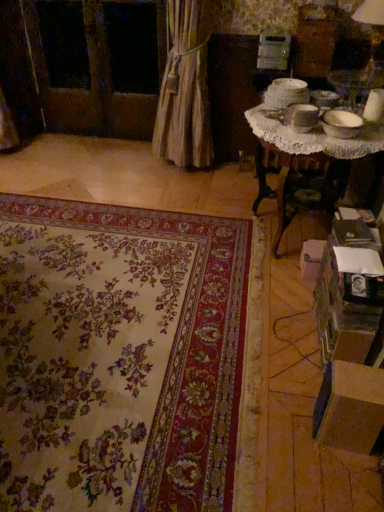
Question: Can you confirm if beige fabric curtain at left is bigger than matte white table lamp at upper right?

Choices:
 (A) yes
 (B) no

Answer: (A)

Question: From a real-world perspective, is beige fabric curtain at left positioned over matte white table lamp at upper right based on gravity?

Choices:
 (A) no
 (B) yes

Answer: (A)

Question: Is beige fabric curtain at left looking in the opposite direction of matte white table lamp at upper right?

Choices:
 (A) yes
 (B) no

Answer: (B)

Question: From a real-world perspective, is beige fabric curtain at left beneath matte white table lamp at upper right?

Choices:
 (A) yes
 (B) no

Answer: (A)

Question: Considering the relative positions of beige fabric curtain at left and matte white table lamp at upper right in the image provided, is beige fabric curtain at left behind matte white table lamp at upper right?

Choices:
 (A) no
 (B) yes

Answer: (B)

Question: In the image, is floral carpet at center positioned in front of or behind white lace table at upper right?

Choices:
 (A) front
 (B) behind

Answer: (A)

Question: From their relative heights in the image, would you say floral carpet at center is taller or shorter than white lace table at upper right?

Choices:
 (A) short
 (B) tall

Answer: (A)

Question: Would you say floral carpet at center is inside or outside white lace table at upper right?

Choices:
 (A) outside
 (B) inside

Answer: (A)

Question: Based on their sizes in the image, would you say floral carpet at center is bigger or smaller than white lace table at upper right?

Choices:
 (A) big
 (B) small

Answer: (B)

Question: In terms of height, does white cardboard box at lower right, the 1th cardboard box positioned from the top, look taller or shorter compared to matte white table lamp at upper right?

Choices:
 (A) tall
 (B) short

Answer: (B)

Question: From the image's perspective, is white cardboard box at lower right, which is the 1th cardboard box in back-to-front order, positioned above or below matte white table lamp at upper right?

Choices:
 (A) below
 (B) above

Answer: (A)

Question: Choose the correct answer: Is white cardboard box at lower right, the 2th cardboard box when ordered from bottom to top, inside matte white table lamp at upper right or outside it?

Choices:
 (A) inside
 (B) outside

Answer: (B)

Question: Looking at their shapes, would you say white cardboard box at lower right, the 2th cardboard box when ordered from bottom to top, is wider or thinner than matte white table lamp at upper right?

Choices:
 (A) thin
 (B) wide

Answer: (A)

Question: In the image, is transparent glass window at upper left positioned in front of or behind matte white table lamp at upper right?

Choices:
 (A) behind
 (B) front

Answer: (A)

Question: Considering the positions of transparent glass window at upper left and matte white table lamp at upper right in the image, is transparent glass window at upper left taller or shorter than matte white table lamp at upper right?

Choices:
 (A) tall
 (B) short

Answer: (A)